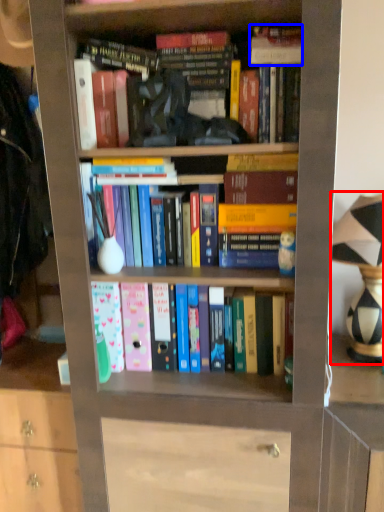
Question: Which point is closer to the camera, table lamp (highlighted by a red box) or book (highlighted by a blue box)?

Choices:
 (A) table lamp
 (B) book

Answer: (A)